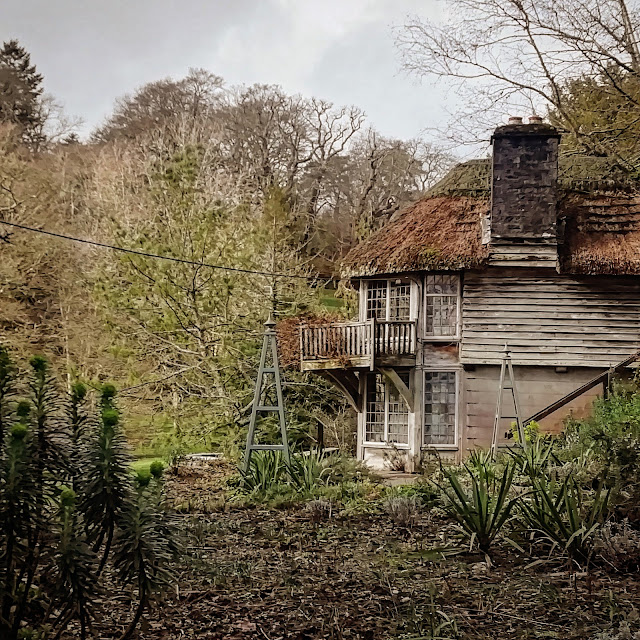
This screenshot has height=640, width=640. What are the coordinates of `stair railing` in the screenshot? It's located at (564, 399), (546, 416).